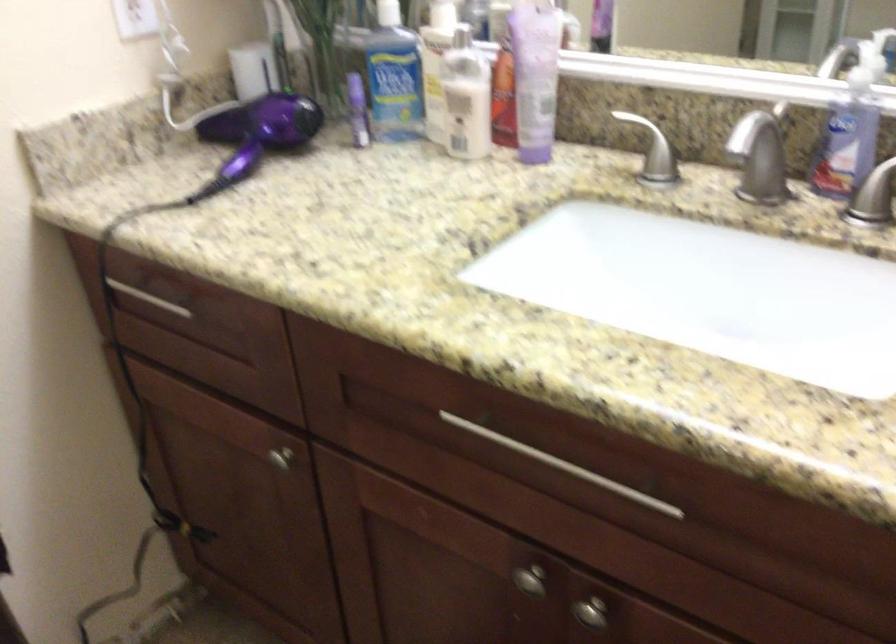
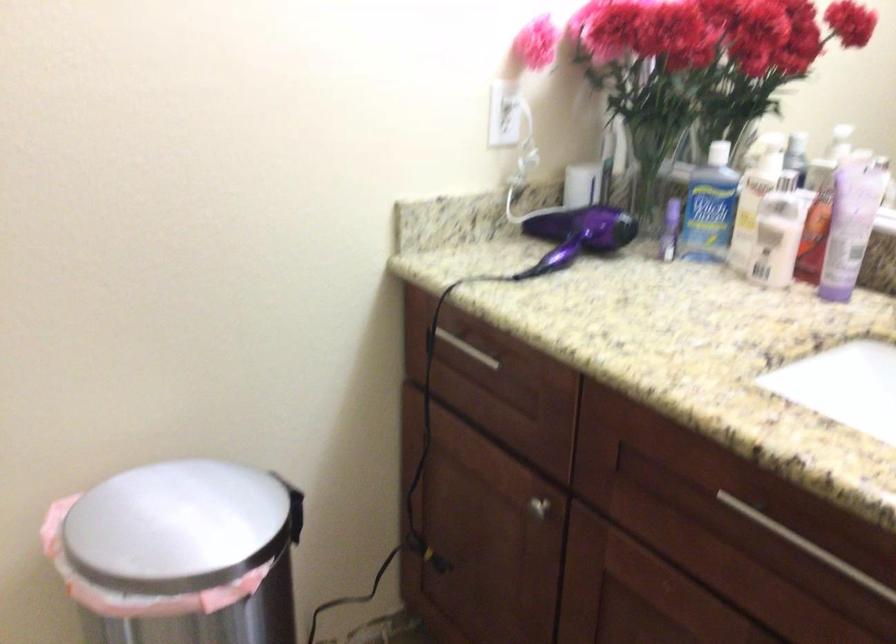
The images are taken continuously from a first-person perspective. In which direction are you moving?

The cameraman walked toward left, backward.